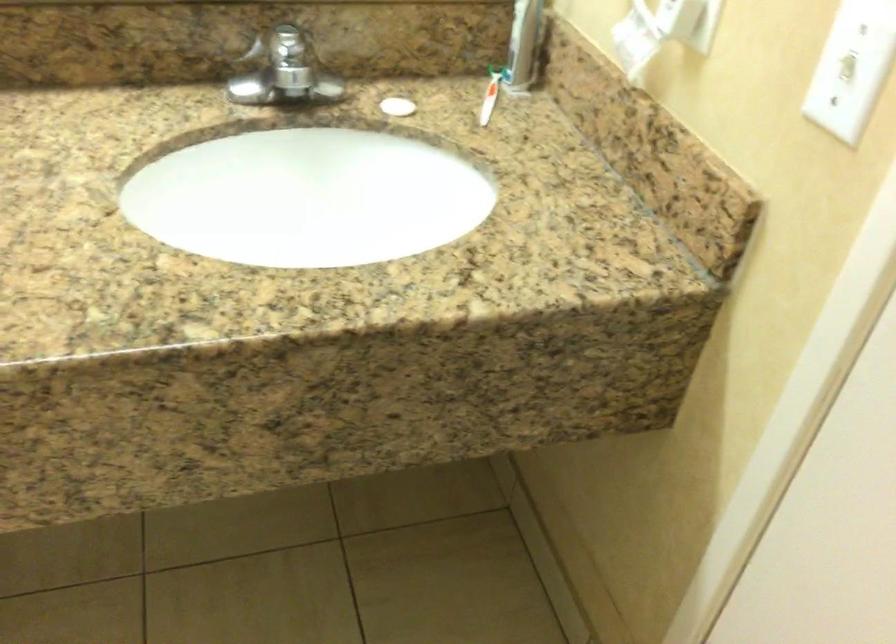
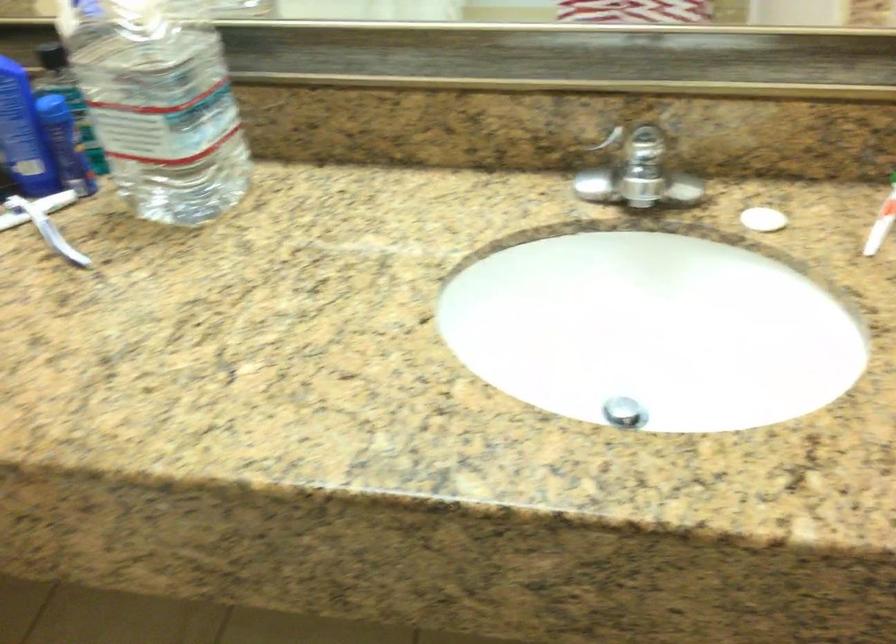
Question: The camera is either moving clockwise (left) or counter-clockwise (right) around the object. The first image is from the beginning of the video and the second image is from the end. Is the camera moving left or right when shooting the video?

Choices:
 (A) Left
 (B) Right

Answer: (B)